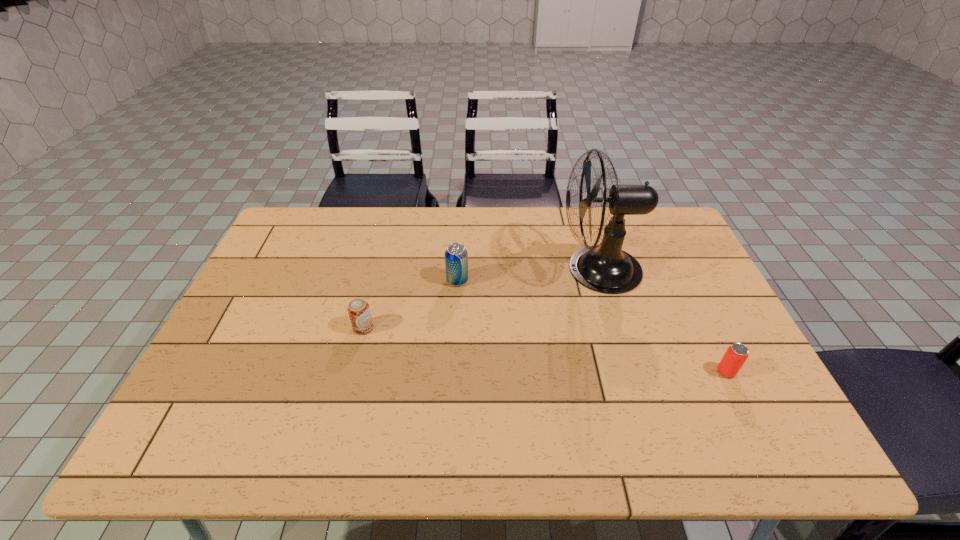
Locate an element on the screen. The image size is (960, 540). the second object from right to left is located at coordinates (605, 268).

Locate an element on the screen. This screenshot has width=960, height=540. fan is located at coordinates (605, 268).

This screenshot has height=540, width=960. In order to click on the second tallest object in this screenshot , I will do `click(456, 256)`.

This screenshot has height=540, width=960. I want to click on the tallest beer can, so tap(456, 256).

The width and height of the screenshot is (960, 540). Identify the location of the second farthest beer can. (358, 309).

Identify the location of the leftmost beer can. (358, 309).

In order to click on the rightmost object in this screenshot , I will do `click(737, 353)`.

This screenshot has width=960, height=540. Identify the location of the nearest object. (737, 353).

Locate an element on the screen. This screenshot has width=960, height=540. vacant region located on the front-facing side of the third object from left to right is located at coordinates (473, 269).

What are the coordinates of `vacant space located on the front-facing side of the third object from left to right` in the screenshot? It's located at (538, 269).